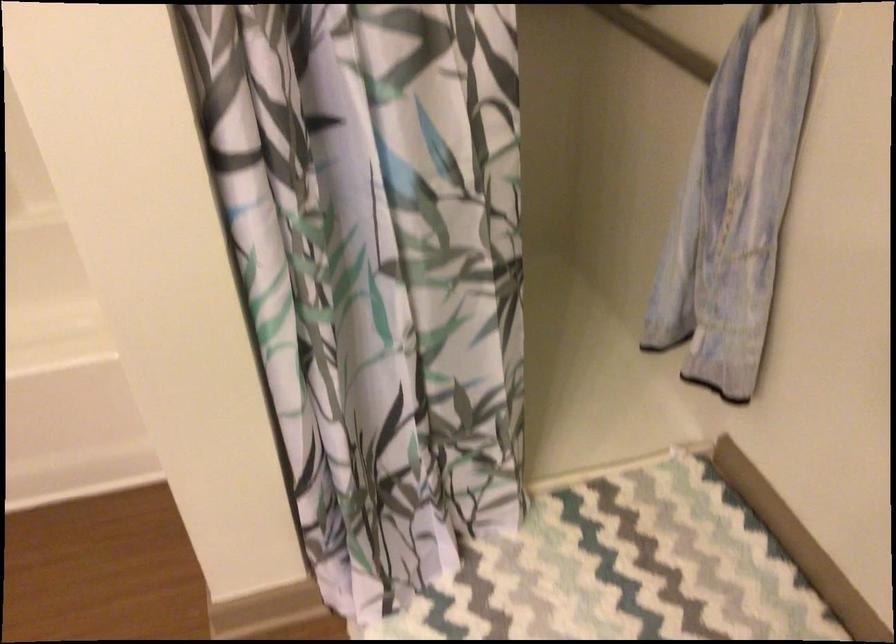
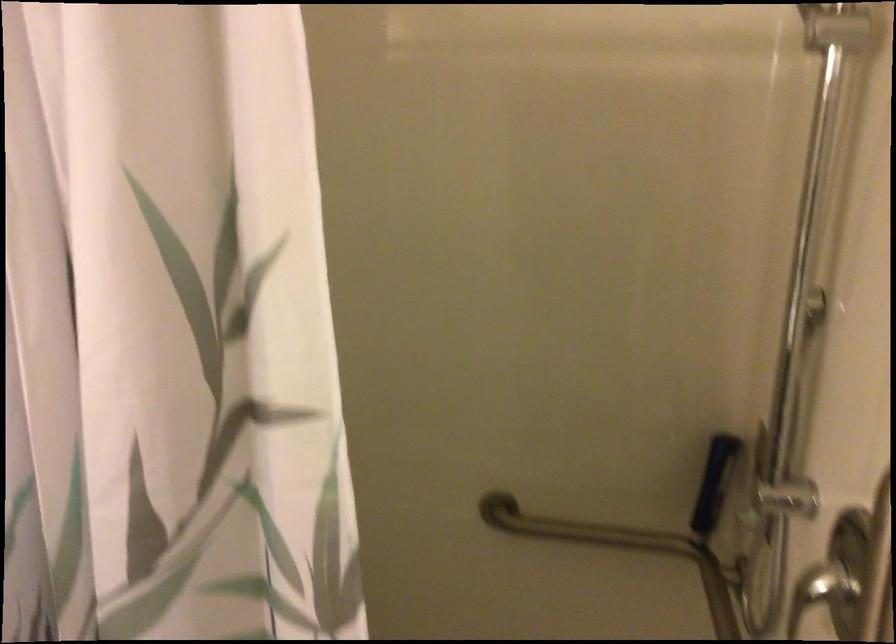
In the scene shown: The images are taken continuously from a first-person perspective. In which direction is your viewpoint rotating?

The camera's rotation is toward left-up.